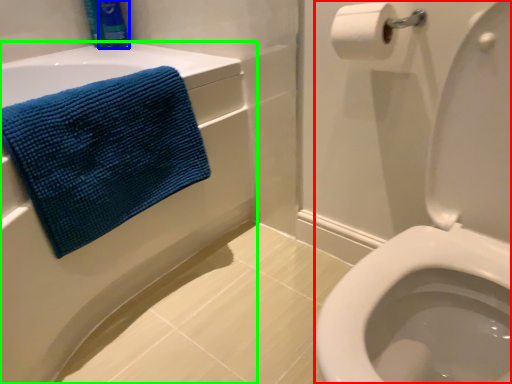
Question: Which object is positioned farthest from sit (highlighted by a red box)? Select from toiletry (highlighted by a blue box) and bath (highlighted by a green box).

Choices:
 (A) toiletry
 (B) bath

Answer: (A)